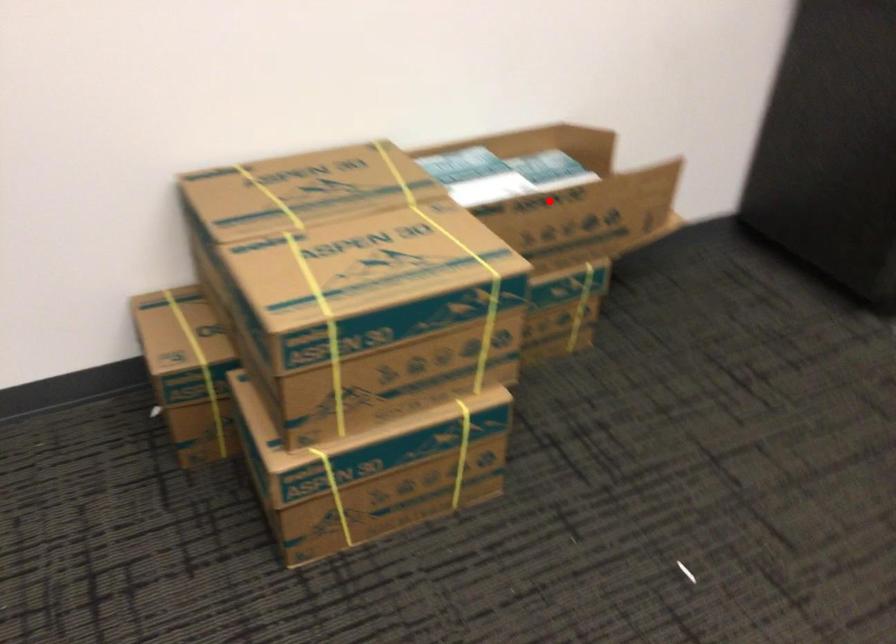
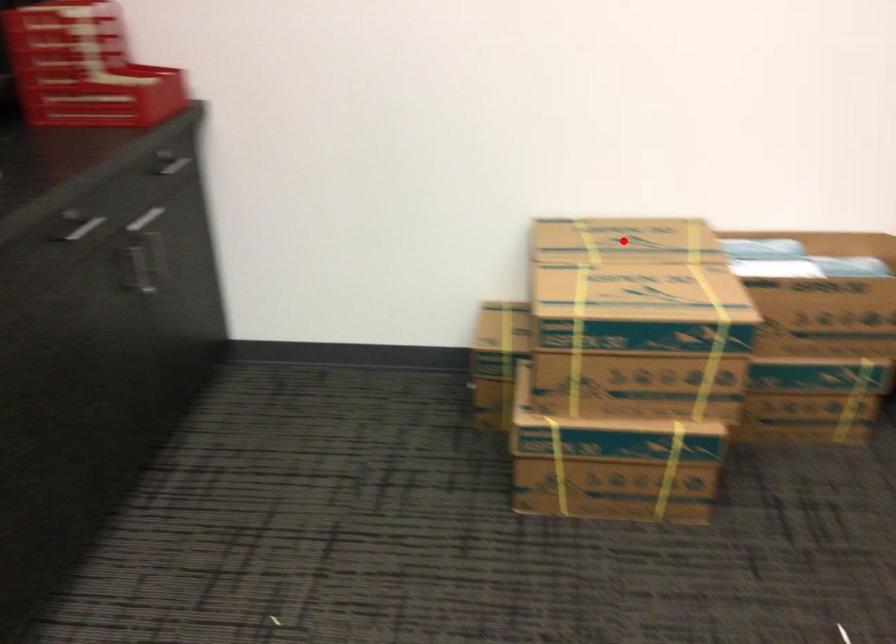
I am providing you with two images of the same scene from different viewpoints. A red point is marked on the first image and another point is marked on the second image. Does the point marked in image1 correspond to the same location as the one in image2?

No